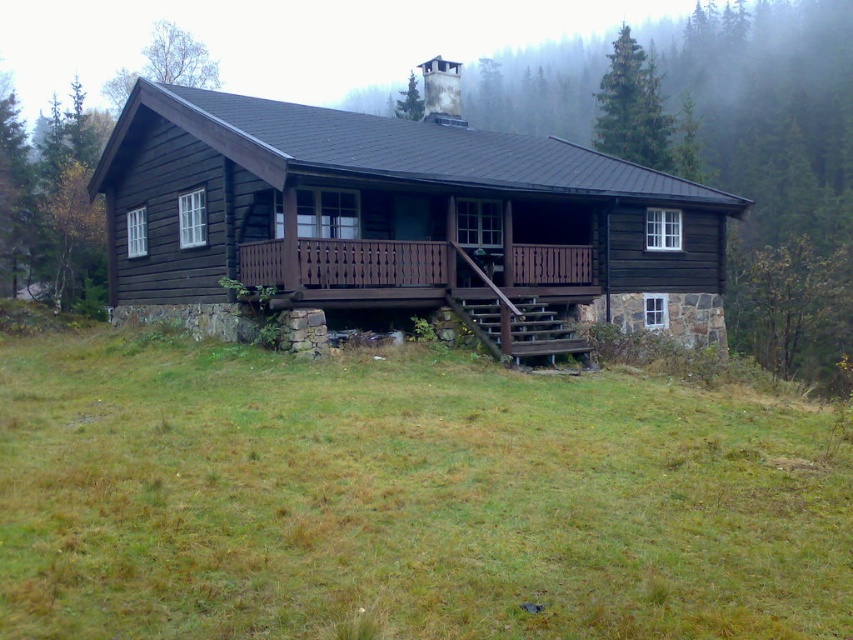
Question: Which point appears closest to the camera in this image?

Choices:
 (A) (635, 97)
 (B) (201, 157)
 (C) (119, 93)

Answer: (B)

Question: Is green matte tree at upper center above green textured tree at upper center?

Choices:
 (A) no
 (B) yes

Answer: (A)

Question: Can you confirm if dark wood cabin at center is smaller than green matte tree at upper center?

Choices:
 (A) yes
 (B) no

Answer: (A)

Question: From the image, what is the correct spatial relationship of dark wood cabin at center in relation to green leafy tree at upper left?

Choices:
 (A) left
 (B) right

Answer: (B)

Question: Based on their relative distances, which object is nearer to the brown wooden porch at center?

Choices:
 (A) green textured tree at upper center
 (B) green matte tree at upper center
 (C) green leafy tree at upper left

Answer: (B)

Question: Considering the real-world distances, which object is closest to the green matte tree at upper center?

Choices:
 (A) dark wood cabin at center
 (B) green textured tree at upper center
 (C) green grass at lower center

Answer: (A)